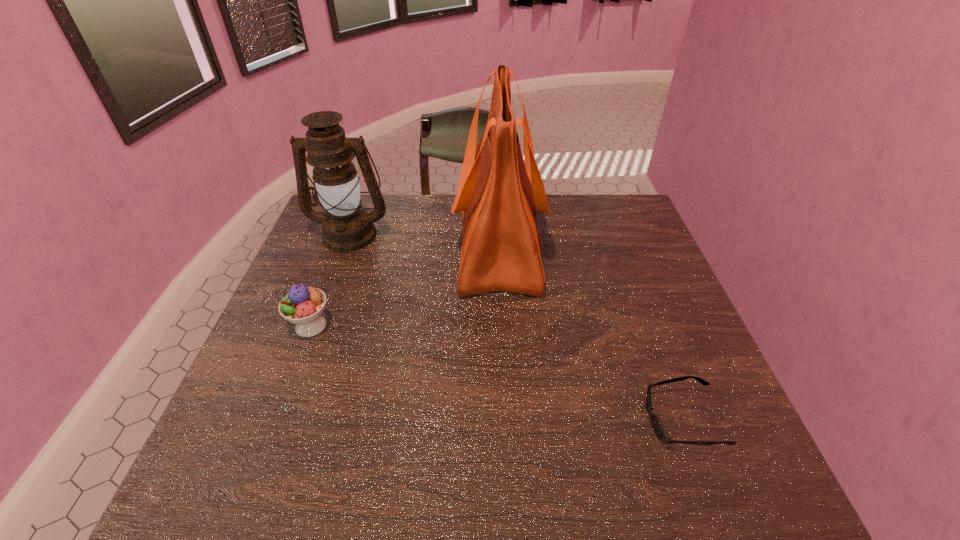
This screenshot has height=540, width=960. Identify the location of vacant space located on the back of the second tallest object. (362, 202).

This screenshot has width=960, height=540. I want to click on vacant space located 0.330m on the back of the icecream, so pos(346,233).

Locate an element on the screen. This screenshot has width=960, height=540. blank area located on the lenses of the rightmost object is located at coordinates (465, 420).

I want to click on free space located on the lenses of the rightmost object, so click(x=592, y=420).

Image resolution: width=960 pixels, height=540 pixels. What are the coordinates of `vacant region located on the lenses of the rightmost object` in the screenshot? It's located at (543, 420).

In order to click on shopping bag located in the far edge section of the desktop in this screenshot , I will do `click(498, 194)`.

The image size is (960, 540). In order to click on oil lamp present at the far edge in this screenshot , I will do `click(346, 228)`.

Identify the location of oil lamp at the left edge. (346, 228).

Find the location of `icecream situated at the left edge`. icecream situated at the left edge is located at coordinates (303, 306).

Find the location of a particular element. object located in the right edge section of the desktop is located at coordinates 657,427.